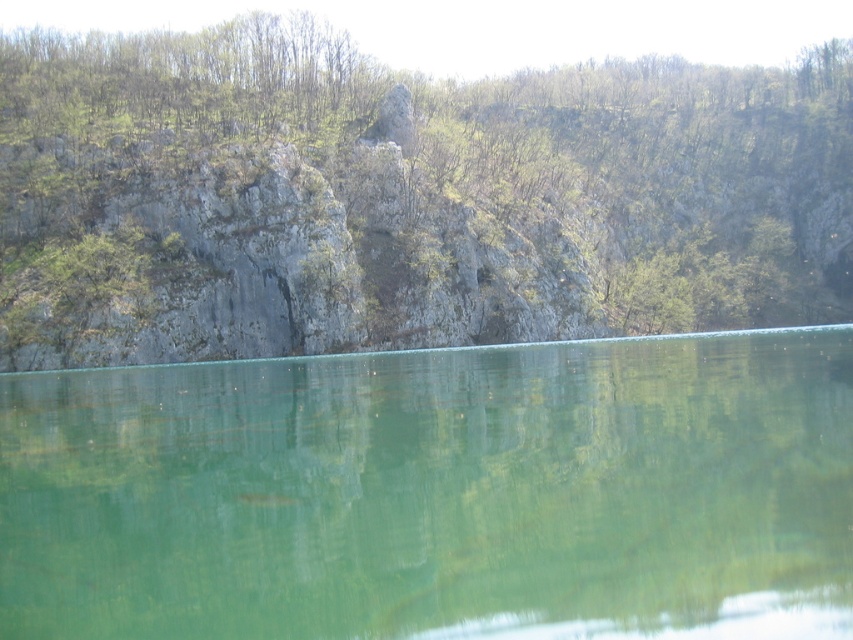
You are standing at the base of the cliff and want to reach the green leafy tree at upper center. The path you take is 251.24 feet long. Is this path the shortest possible route to the tree?

The path you take is 251.24 feet long, which matches the straight line distance between you and the green leafy tree at upper center. Therefore, this path is the shortest possible route to the tree.

You are standing at the origin point of the image. Which direction should you move to reach the green leafy tree at upper center?

The green leafy tree at upper center is located at point (402, 196), so you should move northeast to reach it.

You are an environmental scientist assessing the landscape. You notice the green glassy water at center and the green leafy trees at upper center. Which object is located to the right of the other?

The green glassy water at center is positioned on the right side of green leafy trees at upper center.